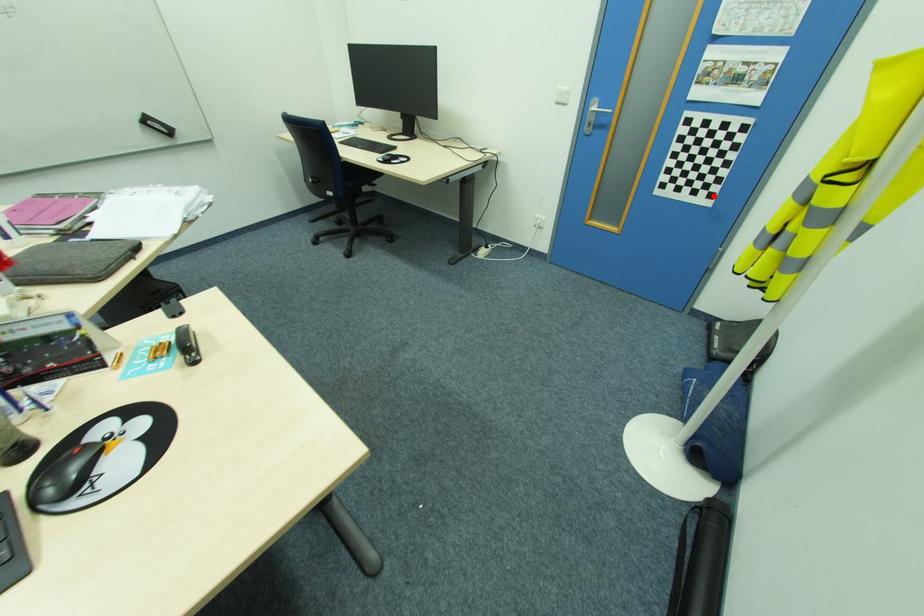
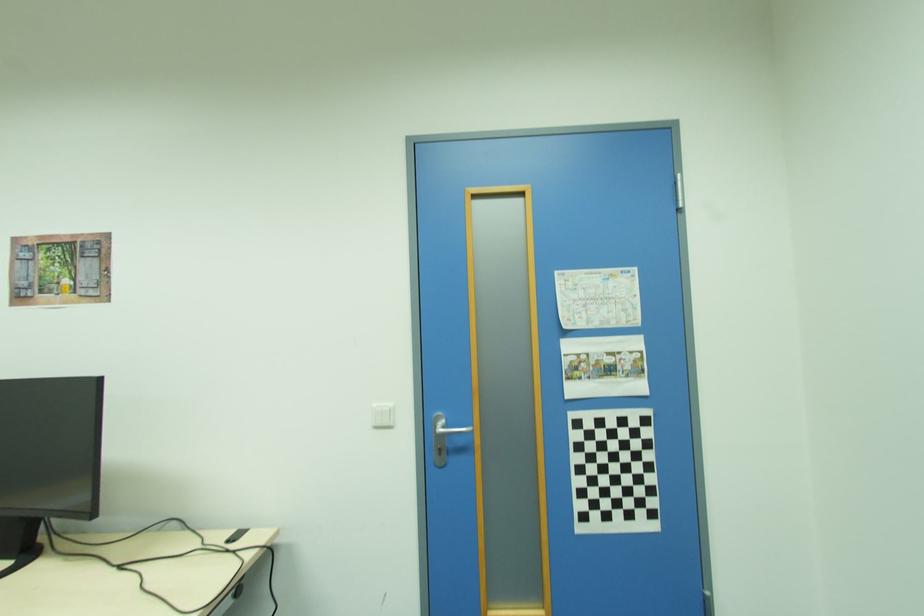
Question: I am providing you with two images of the same scene from different viewpoints. A red point is marked on the first image. At the location where the point appears in image 1, is it still visible in image 2?

Choices:
 (A) Yes
 (B) No

Answer: (A)